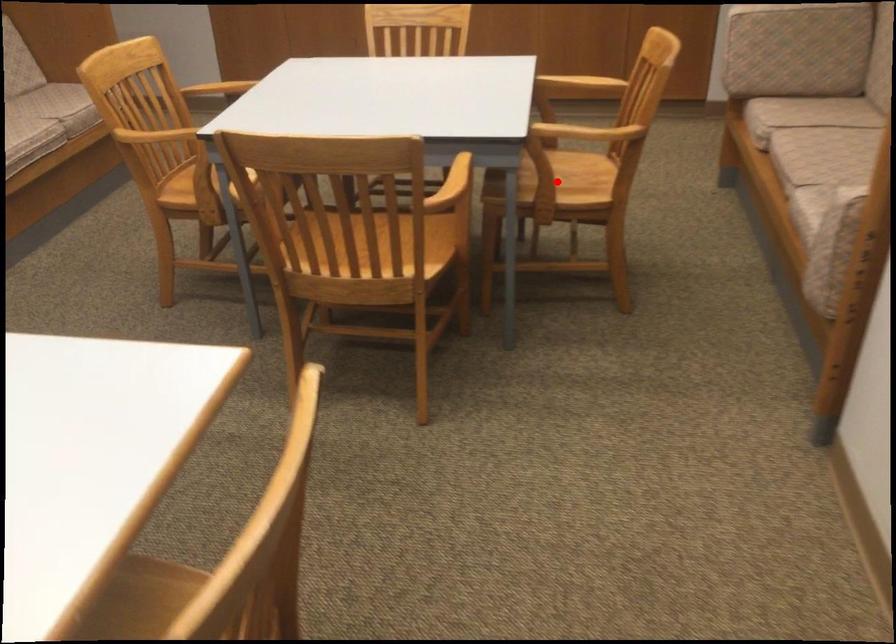
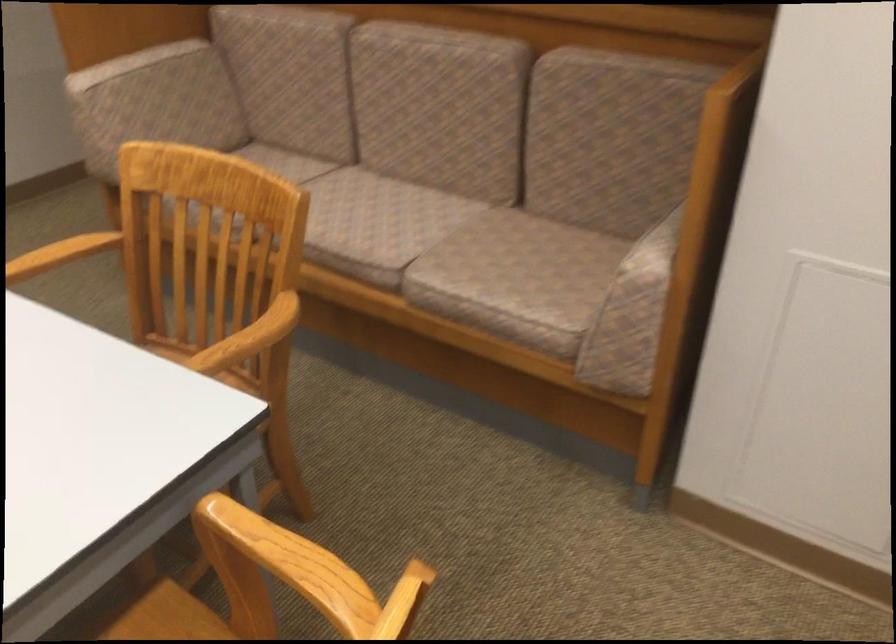
Question: I am providing you with two images of the same scene from different viewpoints. A red point is marked on the first image. Is the red point's position out of view in image 2?

Choices:
 (A) Yes
 (B) No

Answer: (A)